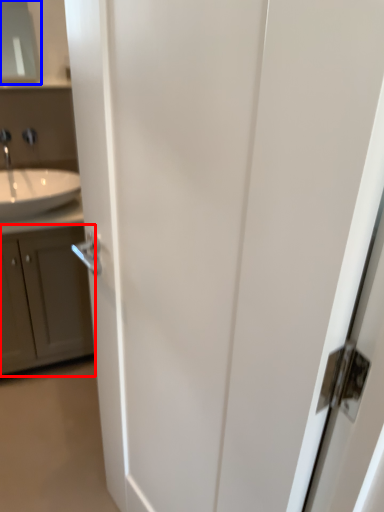
Question: Which object appears farthest to the camera in this image, cabinetry (highlighted by a red box) or medicine cabinet (highlighted by a blue box)?

Choices:
 (A) cabinetry
 (B) medicine cabinet

Answer: (B)